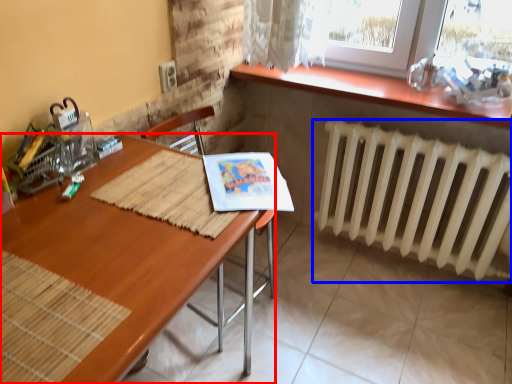
Question: Which of the following is the closest to the observer, desk (highlighted by a red box) or radiator (highlighted by a blue box)?

Choices:
 (A) desk
 (B) radiator

Answer: (A)